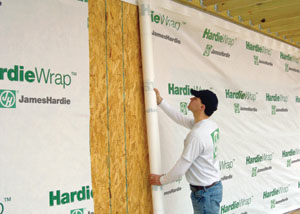
This screenshot has height=214, width=300. What are the coordinates of `floor` in the screenshot? It's located at (297, 211).